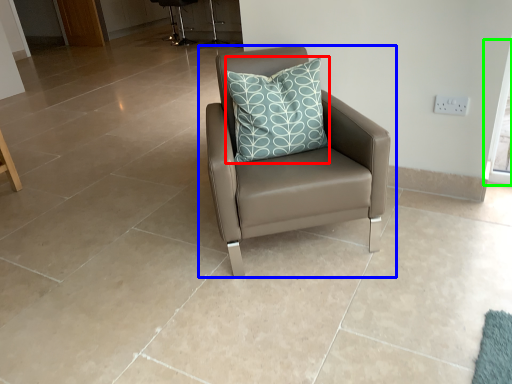
Question: Considering the real-world distances, which object is farthest from pillow (highlighted by a red box)? chair (highlighted by a blue box) or window screen (highlighted by a green box)?

Choices:
 (A) chair
 (B) window screen

Answer: (B)